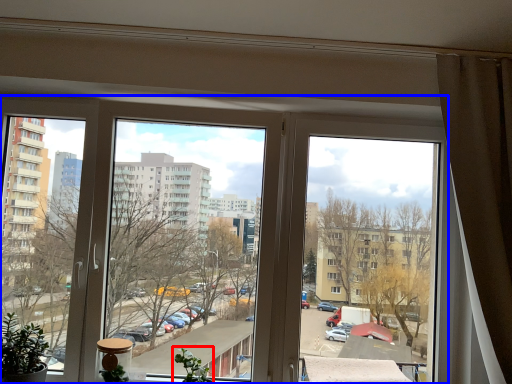
Question: Which of the following is the closest to the observer, plant (highlighted by a red box) or window (highlighted by a blue box)?

Choices:
 (A) plant
 (B) window

Answer: (A)